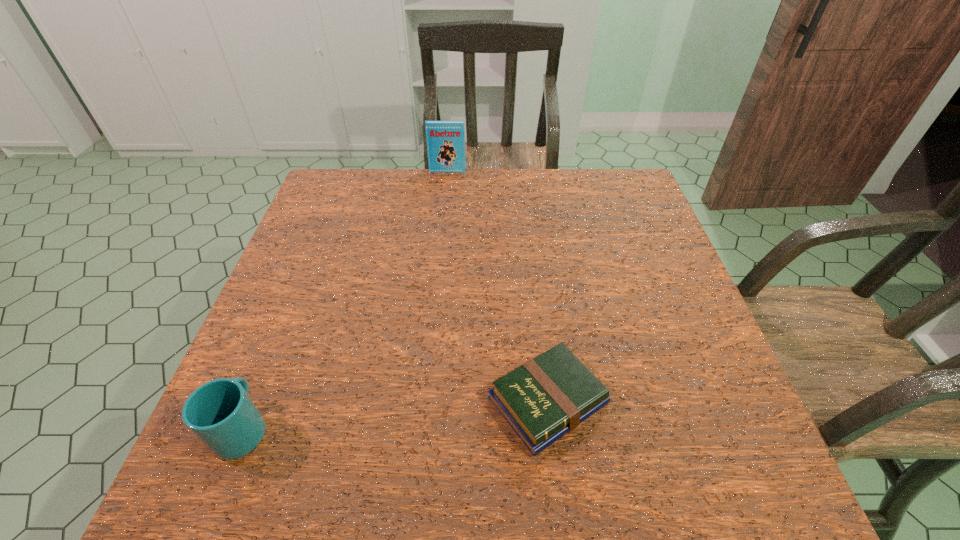
Identify the location of the left book. The image size is (960, 540). (445, 140).

Where is `the taller book`? Image resolution: width=960 pixels, height=540 pixels. the taller book is located at coordinates (445, 140).

You are a GUI agent. You are given a task and a screenshot of the screen. Output one action in this format:
    pyautogui.click(x=<x>, y=<y>)
    Task: Click on the leftmost object
    
    Given the screenshot: What is the action you would take?
    pyautogui.click(x=221, y=414)

Locate an element on the screen. the second shortest object is located at coordinates (221, 414).

Locate an element on the screen. the nearer book is located at coordinates (547, 397).

Image resolution: width=960 pixels, height=540 pixels. Identify the location of the shorter book. (547, 397).

Find the location of a particular element. free space located 0.310m on the front cover of the farther book is located at coordinates (442, 235).

At what (x,y) coordinates should I click in order to perform the action: click on vacant area situated on the handle side of the cup. Please return your answer as a coordinate pair (x, y). The height and width of the screenshot is (540, 960). Looking at the image, I should click on (290, 310).

Where is `vacant space located on the handle side of the cup`? The width and height of the screenshot is (960, 540). vacant space located on the handle side of the cup is located at coordinates (277, 342).

This screenshot has width=960, height=540. What are the coordinates of `free space located on the handle side of the cup` in the screenshot? It's located at (268, 366).